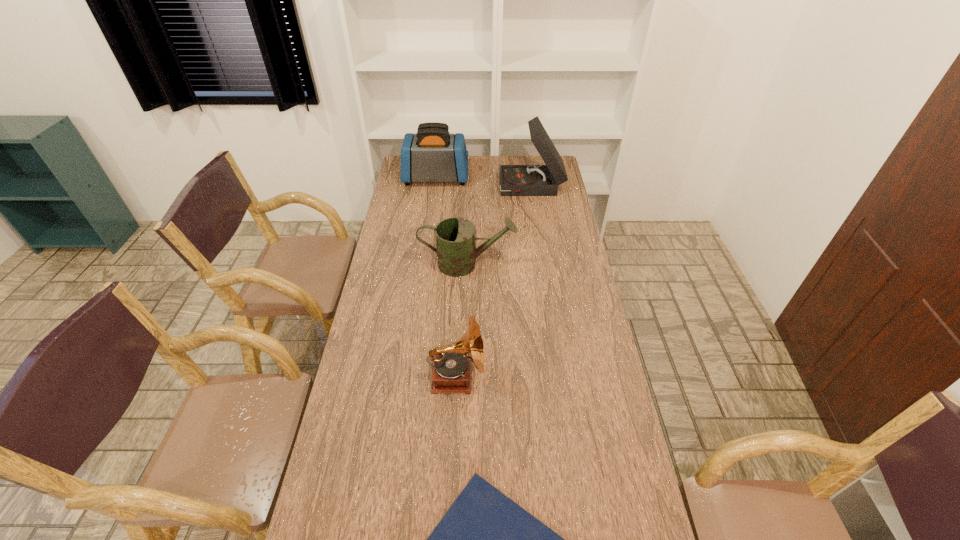
This screenshot has width=960, height=540. What are the coordinates of `free point located 0.280m on the front-facing side of the toaster` in the screenshot? It's located at (523, 178).

You are a GUI agent. You are given a task and a screenshot of the screen. Output one action in this format:
    pyautogui.click(x=<x>, y=<y>)
    Task: Click on the free space located on the horn of the shorter phonograph_record
    This screenshot has height=540, width=960.
    Given the screenshot: What is the action you would take?
    pyautogui.click(x=585, y=377)

Where is `free location located with the spout on the fourth tallest object`? This screenshot has height=540, width=960. free location located with the spout on the fourth tallest object is located at coordinates (542, 264).

Find the location of `phonograph_record that is at the far edge`. phonograph_record that is at the far edge is located at coordinates (515, 180).

You are a GUI agent. You are given a task and a screenshot of the screen. Output one action in this format:
    pyautogui.click(x=<x>, y=<y>)
    Task: Click on the toaster present at the far edge
    The height and width of the screenshot is (540, 960).
    Given the screenshot: What is the action you would take?
    pyautogui.click(x=432, y=154)

You are a GUI agent. You are given a task and a screenshot of the screen. Output one action in this format:
    pyautogui.click(x=<x>, y=<y>)
    Task: Click on the object that is positioned at the left edge
    
    Given the screenshot: What is the action you would take?
    pyautogui.click(x=432, y=154)

Locate an element on the screen. The height and width of the screenshot is (540, 960). object present at the right edge is located at coordinates (515, 180).

Where is `object that is at the far left corner`? object that is at the far left corner is located at coordinates (432, 154).

Where is `object located in the far right corner section of the desktop`? object located in the far right corner section of the desktop is located at coordinates (515, 180).

You are a GUI agent. You are given a task and a screenshot of the screen. Output one action in this format:
    pyautogui.click(x=<x>, y=<y>)
    Task: Click on the blank space at the far edge of the desktop
    
    Given the screenshot: What is the action you would take?
    pyautogui.click(x=499, y=168)